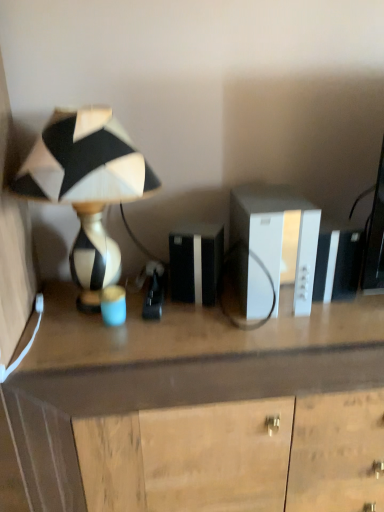
The width and height of the screenshot is (384, 512). Identify the location of vacant area in front of black and white ceramic lamp at left. (94, 352).